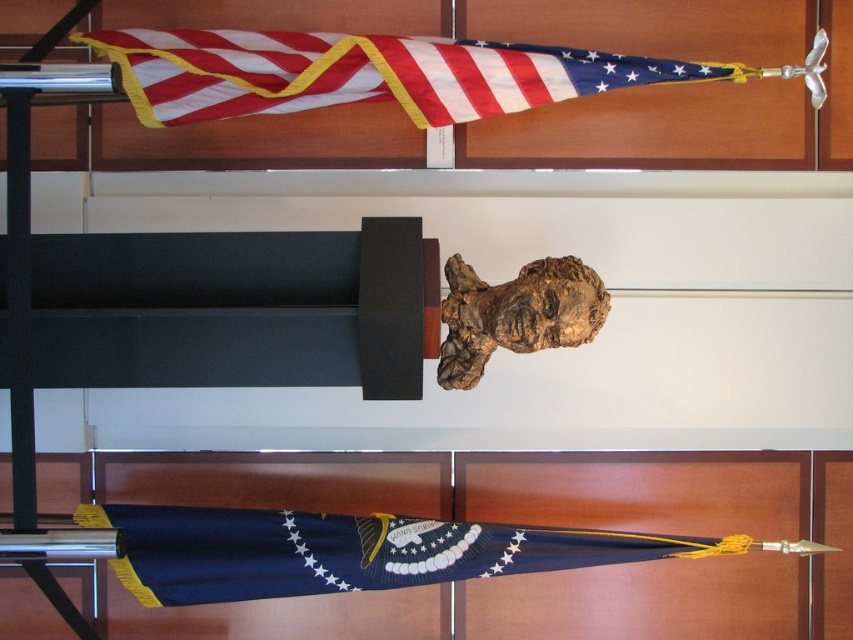
Find the location of a particular element. american flag at upper center is located at coordinates (364, 74).

Identify the location of american flag at upper center. (364, 74).